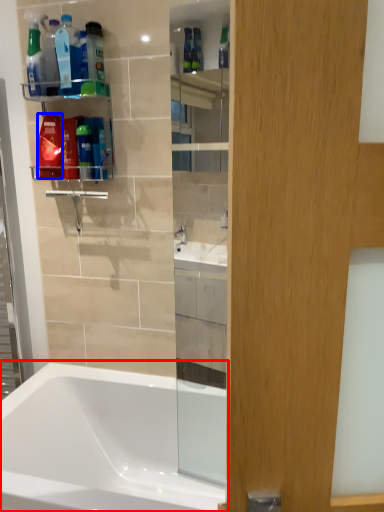
Question: Which object appears farthest to the camera in this image, bathtub (highlighted by a red box) or mouthwash (highlighted by a blue box)?

Choices:
 (A) bathtub
 (B) mouthwash

Answer: (B)